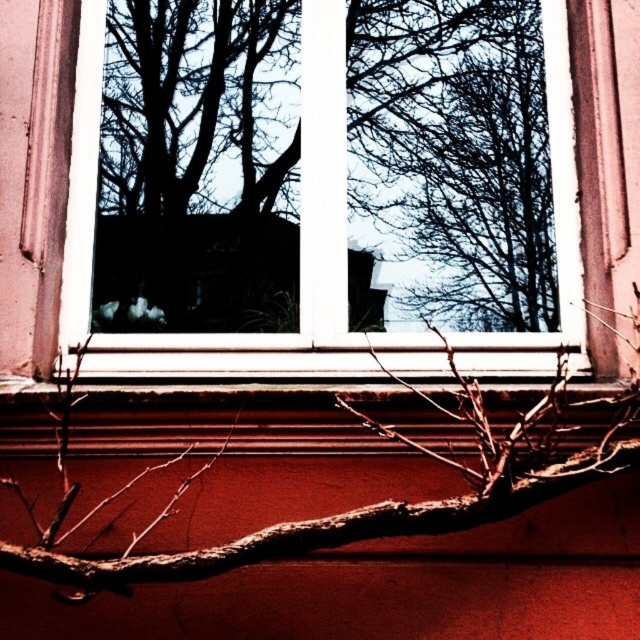
You are standing in front of the window and notice a specific point on the wall. Can you identify what object is located at the coordinates point (193, 163)?

The point (193, 163) corresponds to the black silhouette tree at center.

You are an interior designer assessing the space in the image. You need to determine if the brown rough branch at lower center will fit entirely within the white plastic window frame at center without overlapping its edges. Can it fit?

The white plastic window frame at center is larger in size than the brown rough branch at lower center, so the branch can fit entirely within the window frame without overlapping its edges.

You are an architect designing a new building and want to ensure that the window placement aligns with the existing structure shown in the image. Given the coordinates provided, can you confirm the exact position of the white plastic window frame at center in the image?

The white plastic window frame at center is located at the 2D coordinates point [45,176].